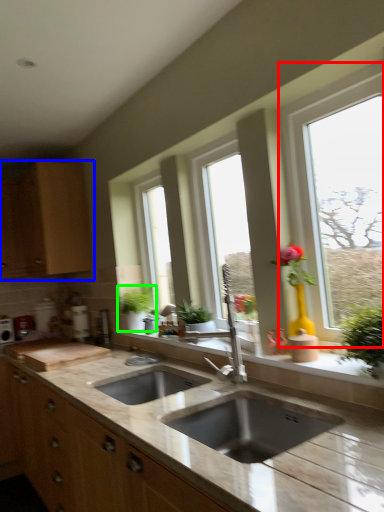
Question: Which is nearer to the window (highlighted by a red box)? cabinetry (highlighted by a blue box) or houseplant (highlighted by a green box).

Choices:
 (A) cabinetry
 (B) houseplant

Answer: (B)